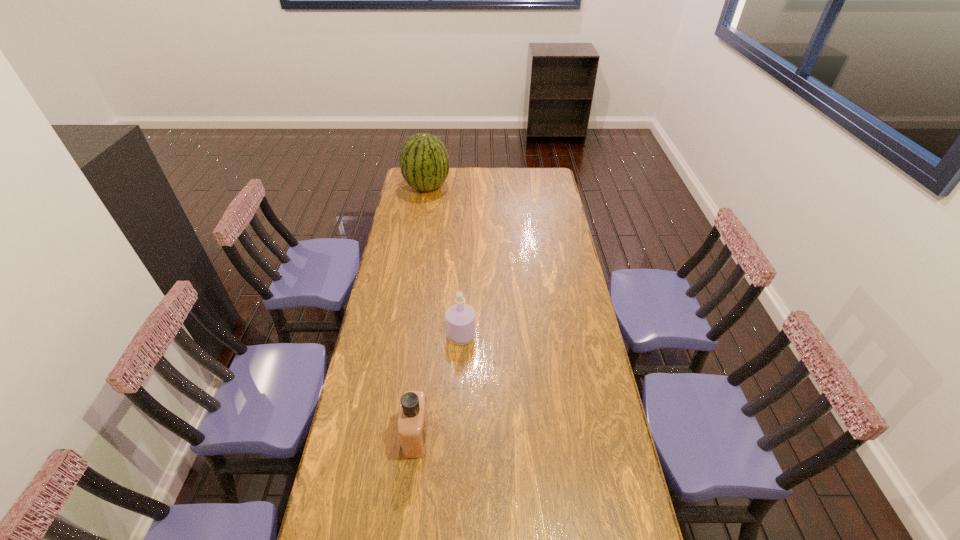
You are a GUI agent. You are given a task and a screenshot of the screen. Output one action in this format:
    pyautogui.click(x=<x>, y=<y>)
    Task: Click on the free space between the watermelon and the second farthest object
    Image resolution: width=960 pixels, height=540 pixels.
    Given the screenshot: What is the action you would take?
    pyautogui.click(x=444, y=261)

Identify the location of vacant area that lies between the right perfume and the watermelon. (444, 261).

At what (x,y) coordinates should I click in order to perform the action: click on free spot between the farthest object and the nearer perfume. Please return your answer as a coordinate pair (x, y). Image resolution: width=960 pixels, height=540 pixels. Looking at the image, I should click on (421, 311).

You are a GUI agent. You are given a task and a screenshot of the screen. Output one action in this format:
    pyautogui.click(x=<x>, y=<y>)
    Task: Click on the free area in between the farthest object and the nearest object
    The width and height of the screenshot is (960, 540).
    Given the screenshot: What is the action you would take?
    pyautogui.click(x=421, y=311)

This screenshot has height=540, width=960. In order to click on vacant space that is in between the nearest object and the second farthest object in this screenshot , I will do `click(439, 386)`.

Find the location of a particular element. The image size is (960, 540). object identified as the closest to the right perfume is located at coordinates (413, 423).

Choose which object is the second nearest neighbor to the farthest object. Please provide its 2D coordinates. Your answer should be formatted as a tuple, i.e. [(x, y)], where the tuple contains the x and y coordinates of a point satisfying the conditions above.

[(413, 423)]

The width and height of the screenshot is (960, 540). I want to click on vacant area in the image that satisfies the following two spatial constraints: 1. on the front side of the farther perfume; 2. on the front label of the nearer perfume, so click(457, 435).

Identify the location of free space in the image that satisfies the following two spatial constraints: 1. on the front side of the rightmost object; 2. on the front label of the nearer perfume. The height and width of the screenshot is (540, 960). (457, 435).